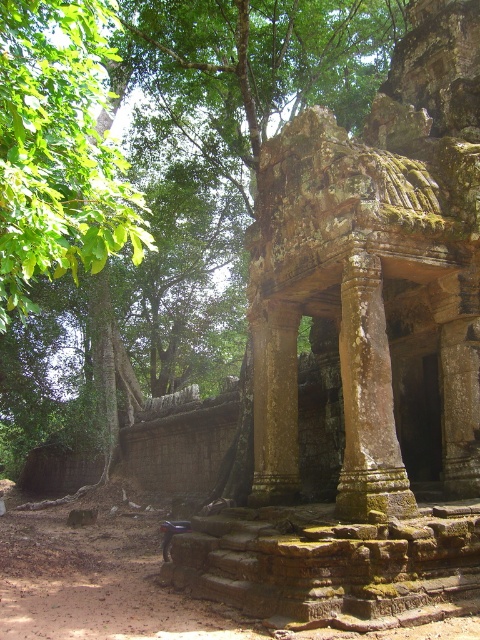
Question: Which object is closer to the camera taking this photo?

Choices:
 (A) green leafy tree at upper left
 (B) weathered stone column at center

Answer: (A)

Question: Considering the relative positions of green leafy tree at upper left and weathered stone column at center in the image provided, where is green leafy tree at upper left located with respect to weathered stone column at center?

Choices:
 (A) below
 (B) above

Answer: (B)

Question: Is green leafy tree at upper left further to the viewer compared to weathered stone column at center?

Choices:
 (A) yes
 (B) no

Answer: (B)

Question: Among these objects, which one is farthest from the camera?

Choices:
 (A) weathered stone column at center
 (B) green leafy tree at upper left

Answer: (A)

Question: Considering the relative positions of green leafy tree at upper left and weathered stone column at center in the image provided, where is green leafy tree at upper left located with respect to weathered stone column at center?

Choices:
 (A) left
 (B) right

Answer: (A)